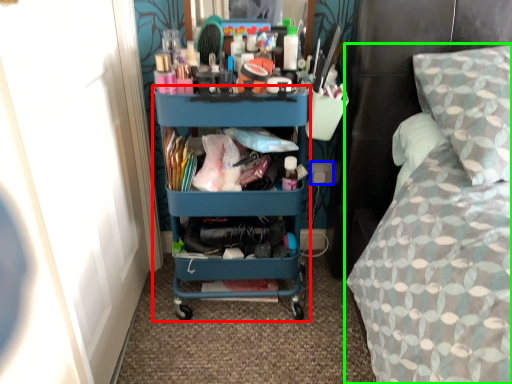
Question: Based on their relative distances, which object is farther from desk (highlighted by a red box)? Choose from power outlet (highlighted by a blue box) and bed (highlighted by a green box).

Choices:
 (A) power outlet
 (B) bed

Answer: (A)